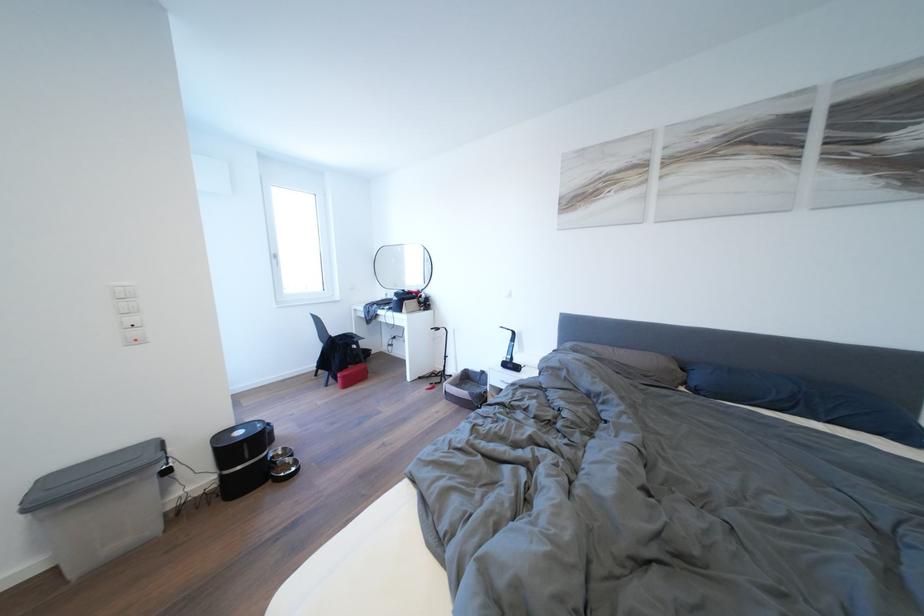
Find where to lift the metal pet bowl. Please return your answer as a coordinate pair (x, y).

(284, 469)